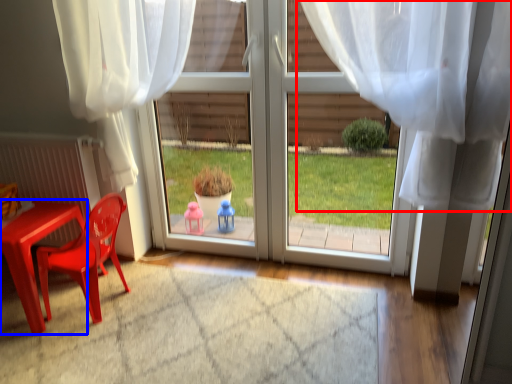
Question: Which object appears farthest to the camera in this image, curtain (highlighted by a red box) or table (highlighted by a blue box)?

Choices:
 (A) curtain
 (B) table

Answer: (B)